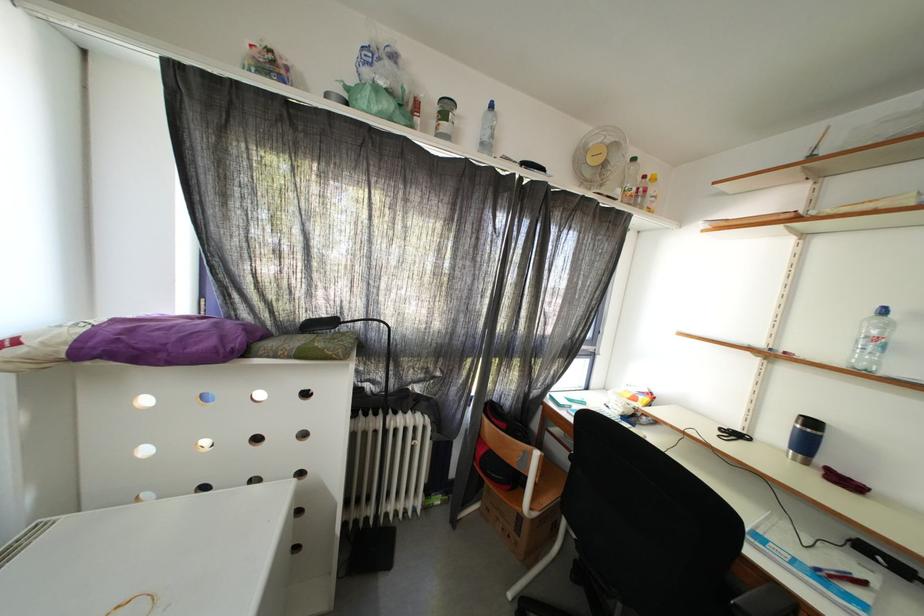
Where would you adjust the black lamp head? Please return your answer as a coordinate pair (x, y).

(319, 323)